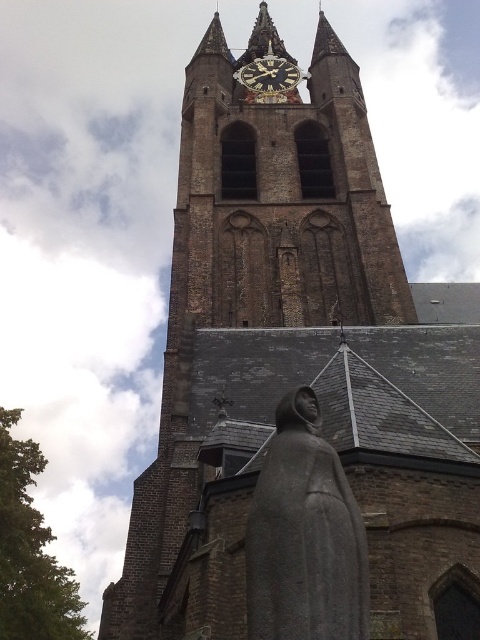
You are standing at the entrance of the historic church tower and want to find the gray stone statue at center. According to the coordinates given, where should you look relative to the tower?

The gray stone statue at center is located at coordinates point (304, 536), which means it is positioned to the right and slightly below the center of the tower.

You are a tourist standing in front of the church tower. You want to take a photo that includes both the gray stone statue at center and the dark brown wooden clock at center. Which object should you focus on first to ensure both are in the frame?

The gray stone statue at center is below the dark brown wooden clock at center, so you should focus on the dark brown wooden clock at center first to ensure both are in the frame.

You are standing in front of the church and want to take a photo of the brown stone clock tower at center. The camera you are using has a zoom lens that can focus on a specific point. The point you should focus on to capture the entire clock tower is point (280,196). Is this point the correct one for the brown stone clock tower at center?

Yes, the point (280,196) is the correct focus point for the brown stone clock tower at center as it is represented by that coordinate.